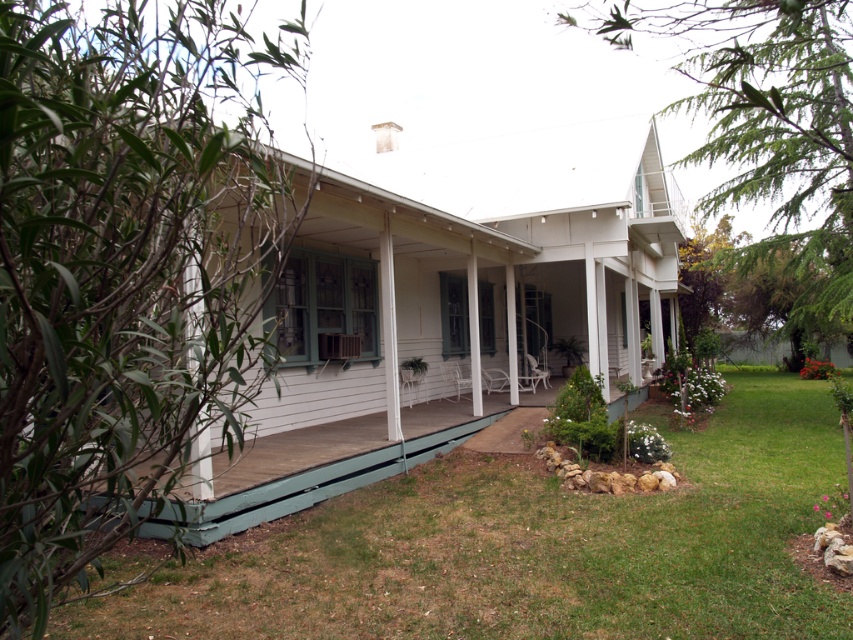
Question: Is green grass at lower left thinner than white wood pillar at center?

Choices:
 (A) yes
 (B) no

Answer: (B)

Question: Which object is the closest to the green painted wood porch at lower left?

Choices:
 (A) white wood pillar at left
 (B) white wood pillar at center
 (C) green grass at lower left

Answer: (A)

Question: Does green grass at lower left have a smaller size compared to green painted wood porch at lower left?

Choices:
 (A) no
 (B) yes

Answer: (A)

Question: Observing the image, what is the correct spatial positioning of green grass at lower left in reference to white wood pillar at left?

Choices:
 (A) right
 (B) left

Answer: (A)

Question: Which point is closer to the camera?

Choices:
 (A) green painted wood porch at lower left
 (B) green grass at lower left
 (C) white wood pillar at center

Answer: (B)

Question: Which is nearer to the green painted wood porch at lower left?

Choices:
 (A) green grass at lower left
 (B) white wood pillar at center

Answer: (B)